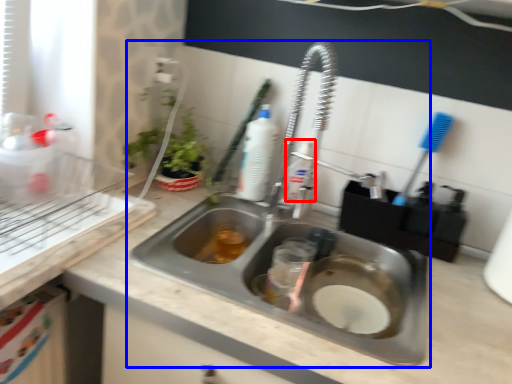
Question: Which object is further to the camera taking this photo, cleaning product (highlighted by a red box) or sink (highlighted by a blue box)?

Choices:
 (A) cleaning product
 (B) sink

Answer: (A)